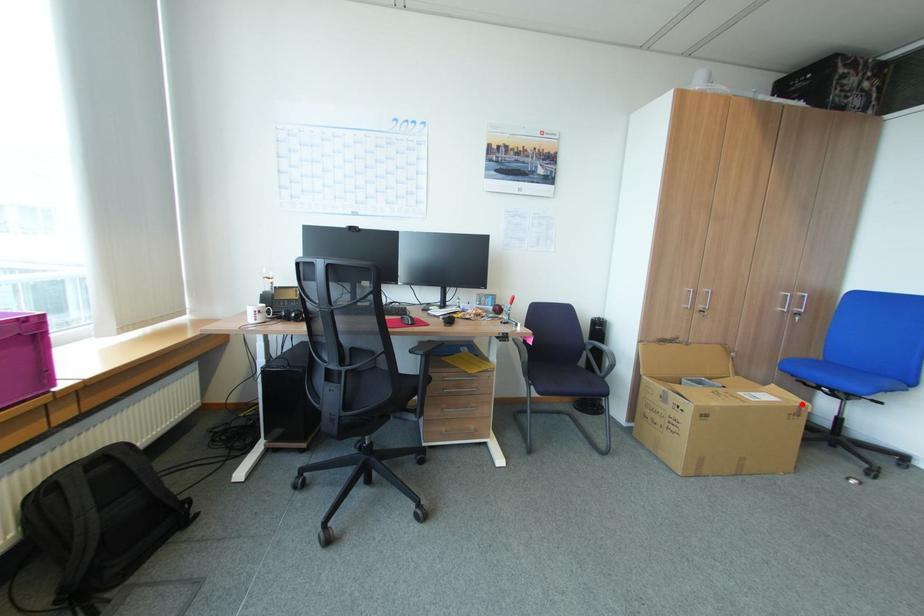
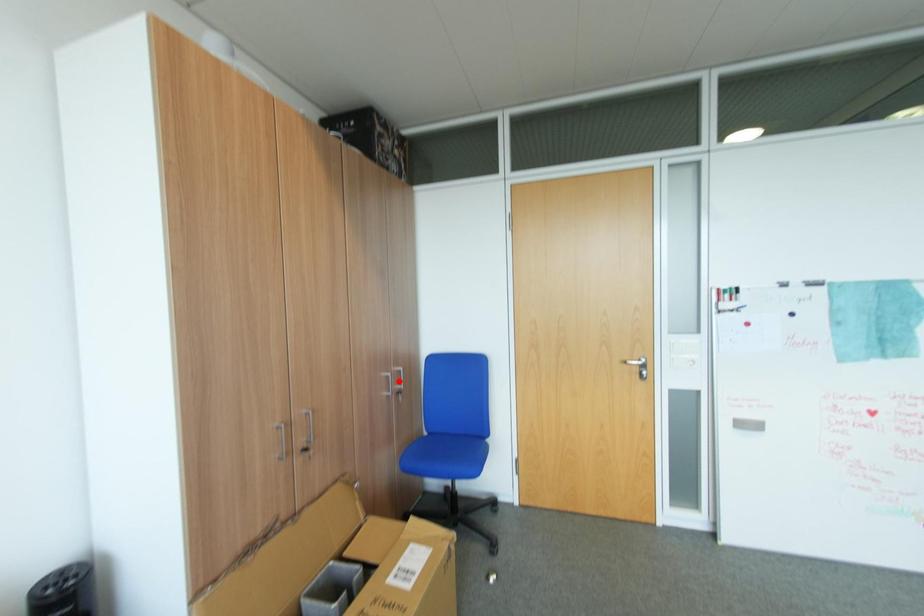
I am providing you with two images of the same scene from different viewpoints. A red point is marked on the first image and another point is marked on the second image. Is the marked point in image1 the same physical position as the marked point in image2?

No